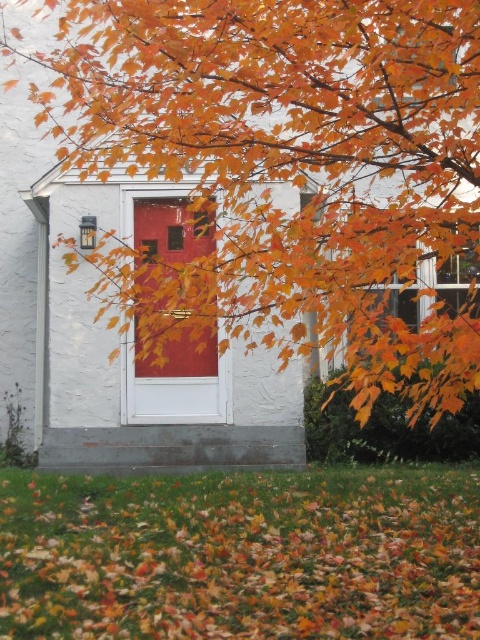
Question: Estimate the real-world distances between objects in this image. Which object is closer to the orange leaf litter at lower center?

Choices:
 (A) orange leafy branches at center
 (B) matte red door at center

Answer: (A)

Question: Is orange leafy branches at center to the left of orange leaf litter at lower center from the viewer's perspective?

Choices:
 (A) yes
 (B) no

Answer: (B)

Question: Can you confirm if orange leafy branches at center is bigger than matte red door at center?

Choices:
 (A) no
 (B) yes

Answer: (B)

Question: Considering the real-world distances, which object is closest to the orange leafy branches at center?

Choices:
 (A) matte red door at center
 (B) orange leaf litter at lower center

Answer: (B)

Question: Does orange leafy branches at center have a lesser width compared to orange leaf litter at lower center?

Choices:
 (A) no
 (B) yes

Answer: (B)

Question: Which point is closer to the camera taking this photo?

Choices:
 (A) (291, 141)
 (B) (469, 632)
 (C) (132, 202)

Answer: (B)